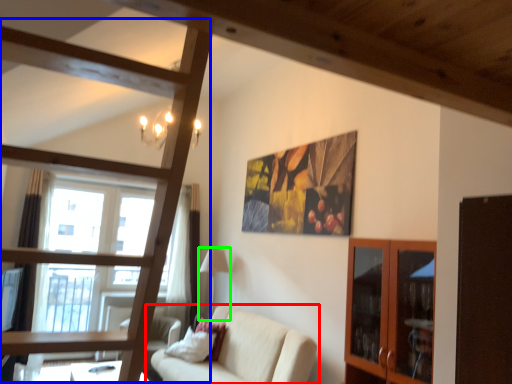
Question: Which object is the closest to the studio couch (highlighted by a red box)? Choose among these: bunk bed (highlighted by a blue box) or lamp (highlighted by a green box).

Choices:
 (A) bunk bed
 (B) lamp

Answer: (B)